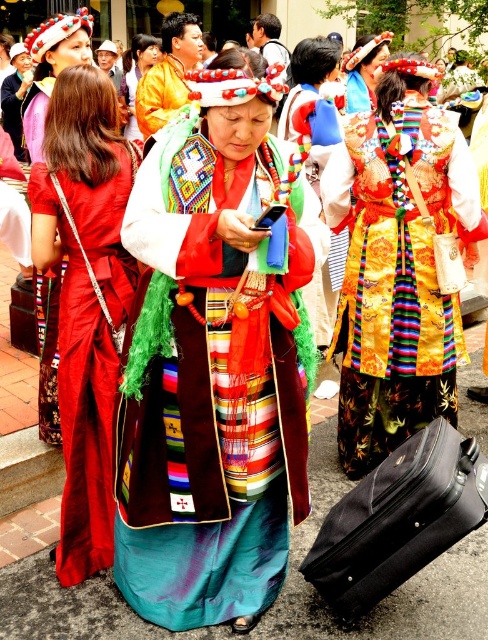
Question: Does silky red dress at center have a smaller size compared to matte red dress at center?

Choices:
 (A) no
 (B) yes

Answer: (B)

Question: Which object is farther from the camera taking this photo?

Choices:
 (A) shiny gold dress at center
 (B) silky red dress at center
 (C) black fabric suitcase at lower right
 (D) matte red dress at center

Answer: (D)

Question: Is shiny gold dress at center bigger than black fabric suitcase at lower right?

Choices:
 (A) no
 (B) yes

Answer: (B)

Question: Which of the following is the closest to the observer?

Choices:
 (A) black fabric suitcase at lower right
 (B) matte red dress at center
 (C) shiny gold dress at center
 (D) silky brocade dress at center

Answer: (D)

Question: Which point appears closest to the camera in this image?

Choices:
 (A) (252, 109)
 (B) (119, 237)
 (C) (378, 460)

Answer: (A)

Question: Does silky brocade dress at center lie behind silky red dress at center?

Choices:
 (A) yes
 (B) no

Answer: (B)